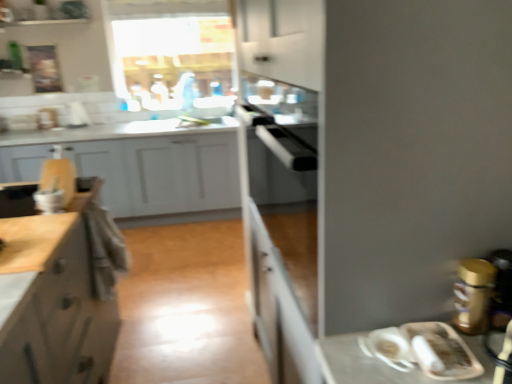
Question: Is matte white cabinet at left, placed as the 2th cabinetry when sorted from back to front, oriented towards wooden cutting board at left, which is counted as the 1th cabinetry, starting from the front?

Choices:
 (A) yes
 (B) no

Answer: (B)

Question: Considering the relative positions of matte white cabinet at left, arranged as the second cabinetry when viewed from the front, and wooden cutting board at left, which is counted as the 1th cabinetry, starting from the front, in the image provided, is matte white cabinet at left, arranged as the second cabinetry when viewed from the front, in front of wooden cutting board at left, which is counted as the 1th cabinetry, starting from the front,?

Choices:
 (A) no
 (B) yes

Answer: (A)

Question: Considering the relative sizes of matte white cabinet at left, arranged as the second cabinetry when viewed from the front, and wooden cutting board at left, which is counted as the 1th cabinetry, starting from the front, in the image provided, is matte white cabinet at left, arranged as the second cabinetry when viewed from the front, thinner than wooden cutting board at left, which is counted as the 1th cabinetry, starting from the front,?

Choices:
 (A) yes
 (B) no

Answer: (B)

Question: Is matte white cabinet at left, arranged as the second cabinetry when viewed from the front, far from wooden cutting board at left, which is counted as the 1th cabinetry, starting from the front?

Choices:
 (A) no
 (B) yes

Answer: (B)

Question: Can you confirm if matte white cabinet at left, arranged as the second cabinetry when viewed from the front, is positioned to the right of wooden cutting board at left, which is counted as the 3th cabinetry, starting from the back?

Choices:
 (A) yes
 (B) no

Answer: (B)

Question: From a real-world perspective, is matte white cabinet at left, arranged as the second cabinetry when viewed from the front, physically above wooden cutting board at left, which is counted as the 3th cabinetry, starting from the back?

Choices:
 (A) yes
 (B) no

Answer: (B)

Question: From the image's perspective, is wooden cutting board at left, which is counted as the 3th cabinetry, starting from the back, on matte white cabinet at left, arranged as the second cabinetry when viewed from the front?

Choices:
 (A) yes
 (B) no

Answer: (A)

Question: Is wooden cutting board at left, which is counted as the 3th cabinetry, starting from the back, shorter than matte white cabinet at left, arranged as the second cabinetry when viewed from the front?

Choices:
 (A) no
 (B) yes

Answer: (B)

Question: Is wooden cutting board at left, which is counted as the 3th cabinetry, starting from the back, behind matte white cabinet at left, arranged as the second cabinetry when viewed from the front?

Choices:
 (A) no
 (B) yes

Answer: (A)

Question: Considering the relative positions of wooden cutting board at left, which is counted as the 1th cabinetry, starting from the front, and matte white cabinet at left, arranged as the second cabinetry when viewed from the front, in the image provided, is wooden cutting board at left, which is counted as the 1th cabinetry, starting from the front, to the left of matte white cabinet at left, arranged as the second cabinetry when viewed from the front, from the viewer's perspective?

Choices:
 (A) no
 (B) yes

Answer: (A)

Question: Does wooden cutting board at left, which is counted as the 1th cabinetry, starting from the front, have a smaller size compared to matte white cabinet at left, arranged as the second cabinetry when viewed from the front?

Choices:
 (A) no
 (B) yes

Answer: (B)

Question: Is wooden cutting board at left, which is counted as the 1th cabinetry, starting from the front, positioned beyond the bounds of matte white cabinet at left, placed as the 2th cabinetry when sorted from back to front?

Choices:
 (A) no
 (B) yes

Answer: (B)

Question: Does matte white cabinet at left, arranged as the second cabinetry when viewed from the front, appear on the left side of white matte cabinet at left, arranged as the 3th cabinetry when viewed from the front?

Choices:
 (A) yes
 (B) no

Answer: (B)